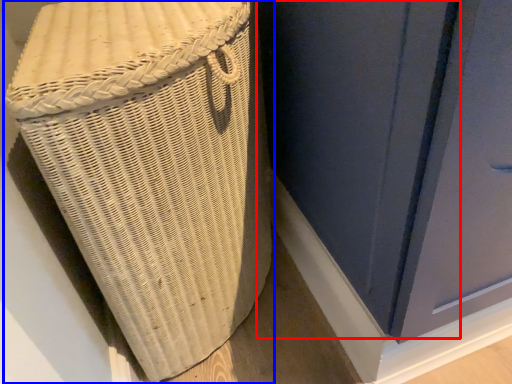
Question: Which of the following is the farthest to the observer, screen door (highlighted by a red box) or furniture (highlighted by a blue box)?

Choices:
 (A) screen door
 (B) furniture

Answer: (B)